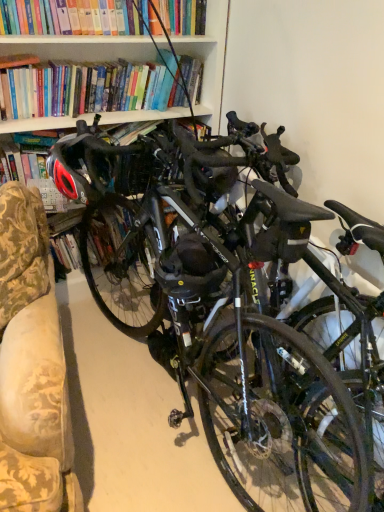
Question: From a real-world perspective, is matte black helmet at center positioned above or below shiny black bicycle at center?

Choices:
 (A) above
 (B) below

Answer: (A)

Question: Is matte black helmet at center taller or shorter than shiny black bicycle at center?

Choices:
 (A) short
 (B) tall

Answer: (A)

Question: Which is nearer to the shiny black helmet at left?

Choices:
 (A) matte black helmet at center
 (B) shiny black bicycle at center

Answer: (A)

Question: Estimate the real-world distances between objects in this image. Which object is farther from the shiny black bicycle at center?

Choices:
 (A) shiny black helmet at left
 (B) matte black helmet at center

Answer: (A)